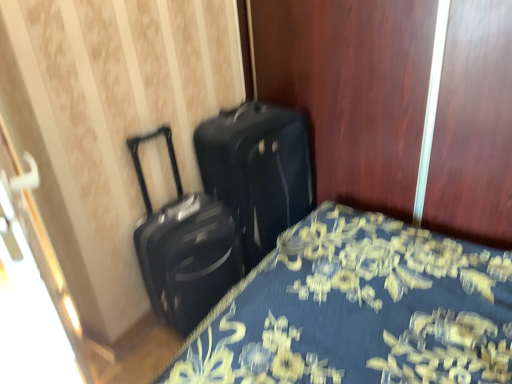
Question: Is black matte suitcase at center, acting as the 1th suitcase starting from the left, aimed at blue floral fabric bed at lower left?

Choices:
 (A) yes
 (B) no

Answer: (B)

Question: Is blue floral fabric bed at lower left inside black matte suitcase at center, acting as the 1th suitcase starting from the left?

Choices:
 (A) yes
 (B) no

Answer: (B)

Question: Is black matte suitcase at center, the second suitcase when ordered from right to left, turned away from blue floral fabric bed at lower left?

Choices:
 (A) yes
 (B) no

Answer: (B)

Question: Is black matte suitcase at center, acting as the 1th suitcase starting from the left, positioned beyond the bounds of blue floral fabric bed at lower left?

Choices:
 (A) no
 (B) yes

Answer: (B)

Question: From a real-world perspective, is black matte suitcase at center, the second suitcase when ordered from right to left, located higher than blue floral fabric bed at lower left?

Choices:
 (A) yes
 (B) no

Answer: (A)

Question: Considering their positions, is black matte suitcase at center, acting as the 1th suitcase starting from the left, located in front of or behind black matte suitcase at center, arranged as the second suitcase when viewed from the left?

Choices:
 (A) front
 (B) behind

Answer: (A)

Question: From a real-world perspective, relative to black matte suitcase at center, arranged as the second suitcase when viewed from the left, is black matte suitcase at center, acting as the 1th suitcase starting from the left, vertically above or below?

Choices:
 (A) below
 (B) above

Answer: (B)

Question: Is black matte suitcase at center, acting as the 1th suitcase starting from the left, wider or thinner than black matte suitcase at center, arranged as the 1th suitcase when viewed from the right?

Choices:
 (A) wide
 (B) thin

Answer: (B)

Question: Visually, is black matte suitcase at center, acting as the 1th suitcase starting from the left, positioned to the left or to the right of black matte suitcase at center, arranged as the 1th suitcase when viewed from the right?

Choices:
 (A) right
 (B) left

Answer: (B)

Question: From the image's perspective, is black matte suitcase at center, arranged as the 1th suitcase when viewed from the right, located above or below black matte suitcase at center, acting as the 1th suitcase starting from the left?

Choices:
 (A) below
 (B) above

Answer: (B)

Question: Is black matte suitcase at center, arranged as the 1th suitcase when viewed from the right, wider or thinner than black matte suitcase at center, acting as the 1th suitcase starting from the left?

Choices:
 (A) wide
 (B) thin

Answer: (A)

Question: Is black matte suitcase at center, arranged as the 1th suitcase when viewed from the right, bigger or smaller than black matte suitcase at center, the second suitcase when ordered from right to left?

Choices:
 (A) big
 (B) small

Answer: (A)

Question: Based on their positions, is black matte suitcase at center, arranged as the second suitcase when viewed from the left, located to the left or right of black matte suitcase at center, acting as the 1th suitcase starting from the left?

Choices:
 (A) right
 (B) left

Answer: (A)

Question: Is blue floral fabric bed at lower left bigger or smaller than black matte suitcase at center, acting as the 1th suitcase starting from the left?

Choices:
 (A) big
 (B) small

Answer: (A)

Question: From the image's perspective, is blue floral fabric bed at lower left positioned above or below black matte suitcase at center, the second suitcase when ordered from right to left?

Choices:
 (A) above
 (B) below

Answer: (B)